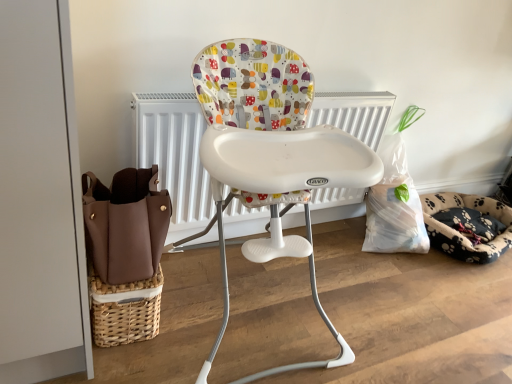
What are the coordinates of `free area below white plastic highchair at center (from a real-world perspective)` in the screenshot? It's located at (257, 322).